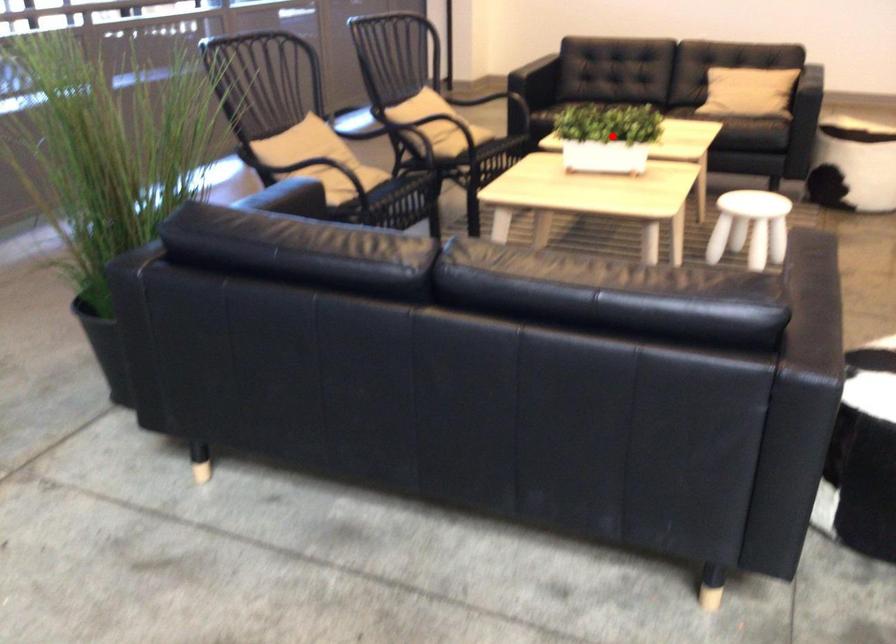
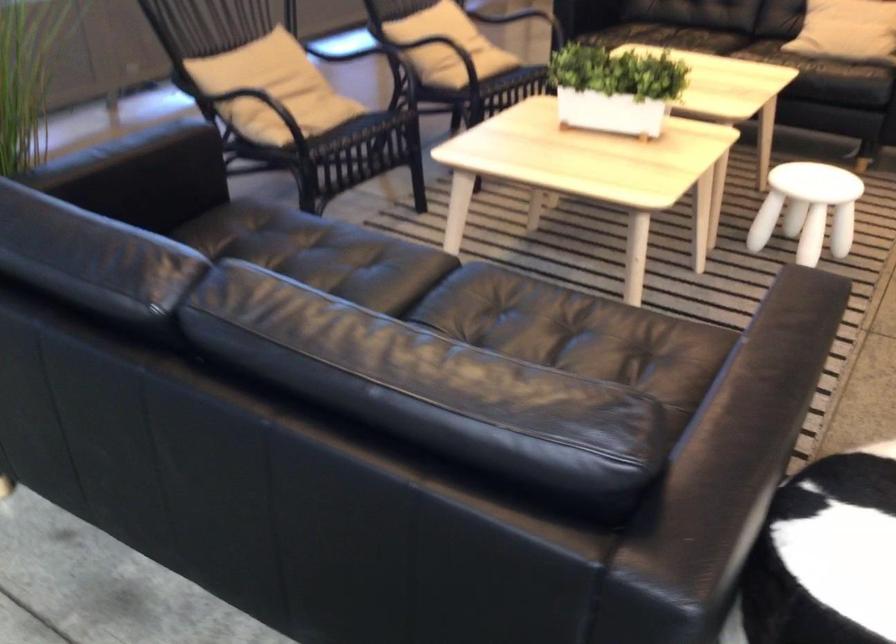
Locate, in the second image, the point that corresponds to the highlighted location in the first image.

(615, 88)